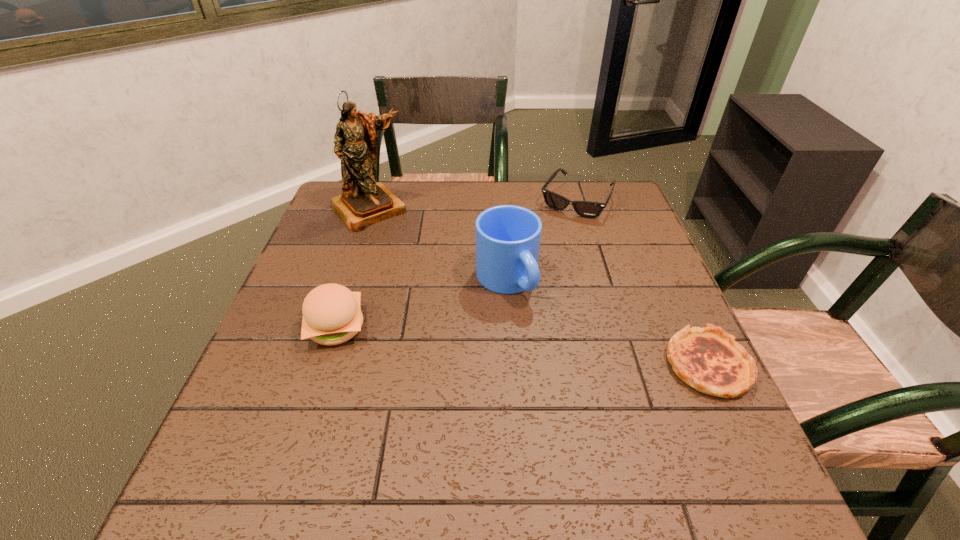
Locate an element on the screen. The height and width of the screenshot is (540, 960). the fourth closest object to the hamburger is located at coordinates (708, 359).

This screenshot has height=540, width=960. I want to click on vacant space that satisfies the following two spatial constraints: 1. on the front side of the figurine; 2. on the left side of the third object from left to right, so click(x=346, y=280).

The width and height of the screenshot is (960, 540). Find the location of `free spot that satisfies the following two spatial constraints: 1. on the front side of the quiche; 2. on the left side of the sunglasses`. free spot that satisfies the following two spatial constraints: 1. on the front side of the quiche; 2. on the left side of the sunglasses is located at coordinates (625, 364).

Identify the location of vacant region that satisfies the following two spatial constraints: 1. on the front side of the shortest object; 2. on the right side of the figurine. Image resolution: width=960 pixels, height=540 pixels. (317, 364).